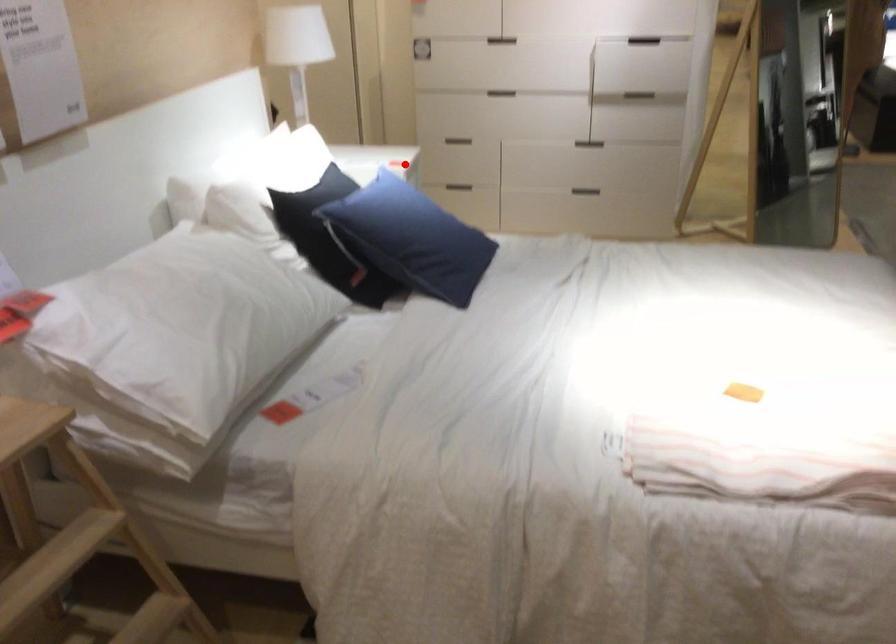
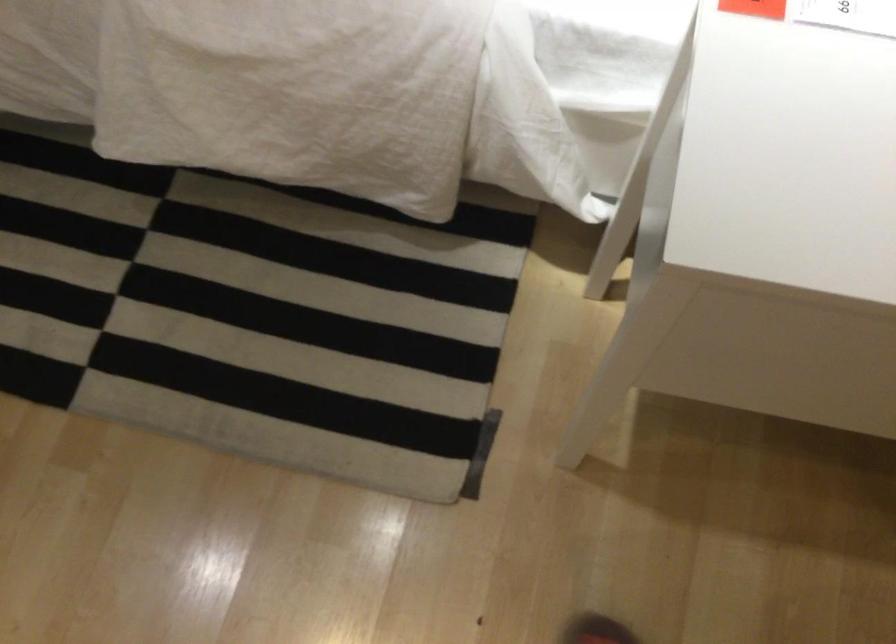
Question: I am providing you with two images of the same scene from different viewpoints. Given a red point in image1, look at the same physical point in image2. Is it:

Choices:
 (A) Closer to the viewpoint
 (B) Farther from the viewpoint

Answer: (A)